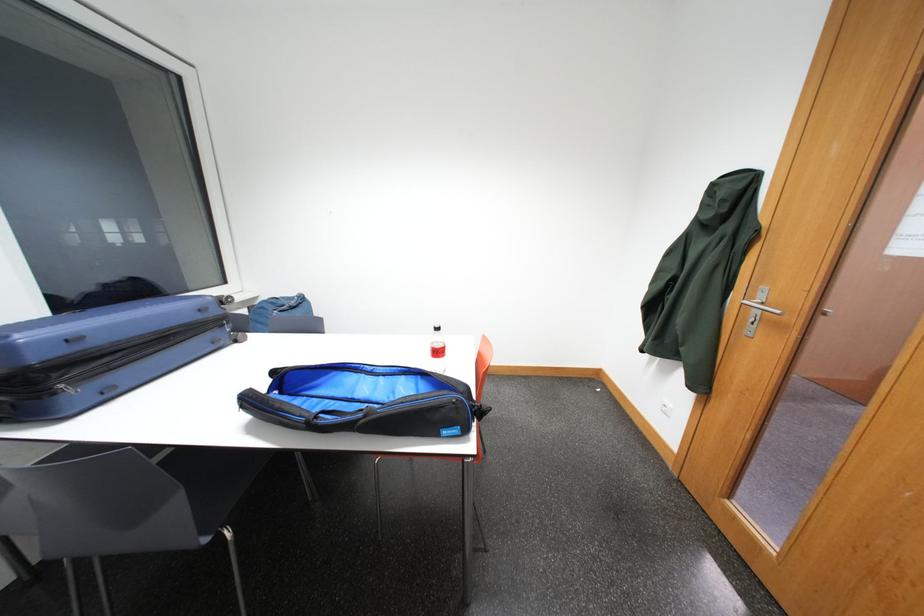
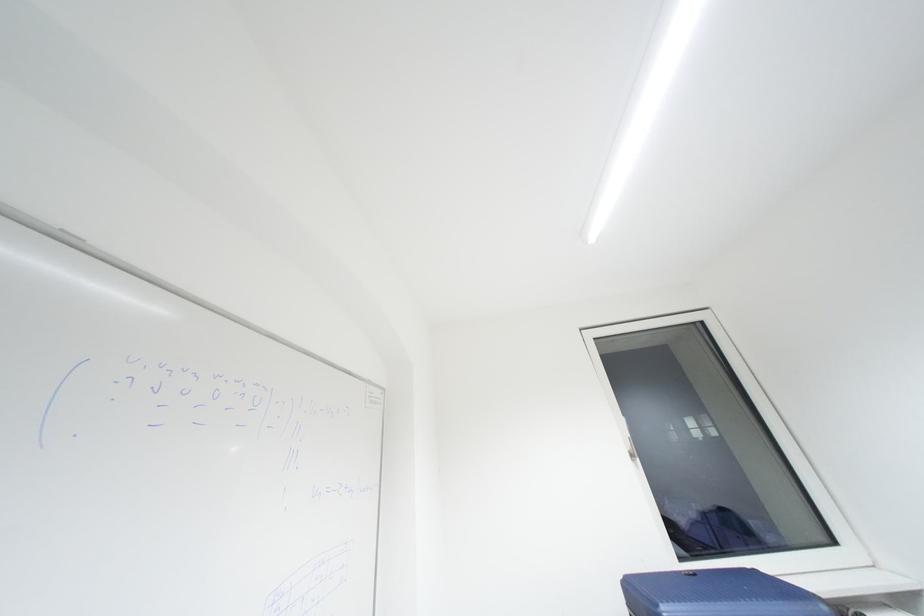
Based on the photo, based on the continuous images, in which direction is the camera rotating?

The camera's rotation is toward left-up.